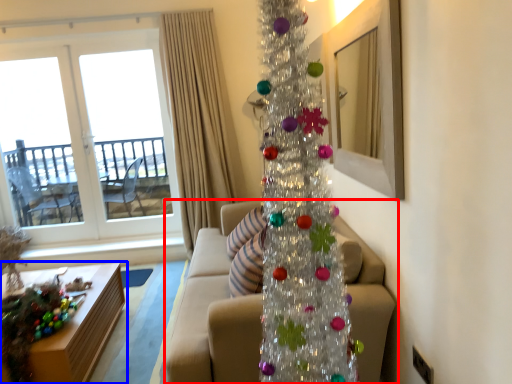
Question: Among these objects, which one is farthest to the camera, studio couch (highlighted by a red box) or table (highlighted by a blue box)?

Choices:
 (A) studio couch
 (B) table

Answer: (B)